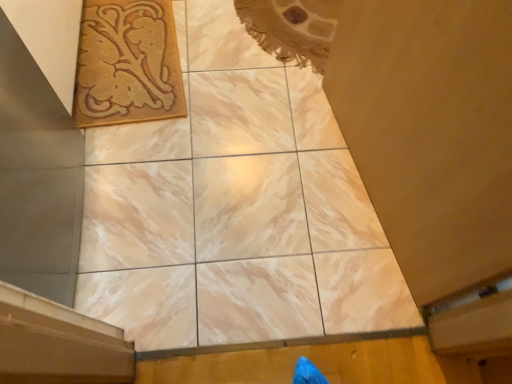
Where is `vacant region to the left of marble tile at center`? Image resolution: width=512 pixels, height=384 pixels. vacant region to the left of marble tile at center is located at coordinates (147, 204).